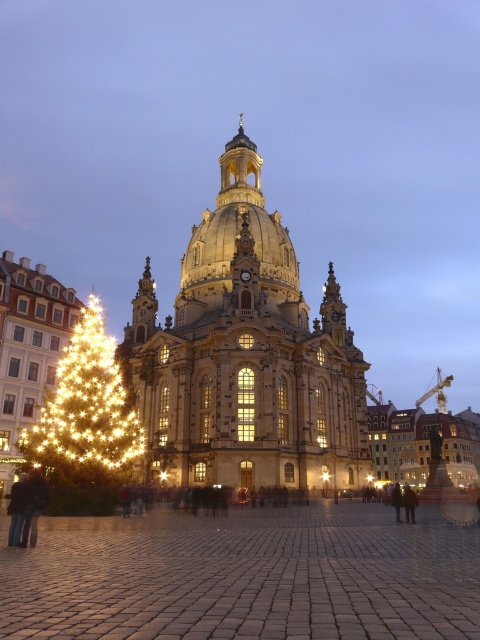
You are standing in front of the golden stone church at center and the illuminated gold christmas tree at left. Which object is positioned to the right of the other?

The golden stone church at center is positioned to the right of the illuminated gold christmas tree at left.

You are standing in front of the historic building and want to take a photo that includes both the brown cobblestone at center and the golden stone church at center. Which object should you focus on first to ensure both are in clear view?

You should focus on the brown cobblestone at center first because it is closer to you than the golden stone church at center, ensuring both are in clear view.